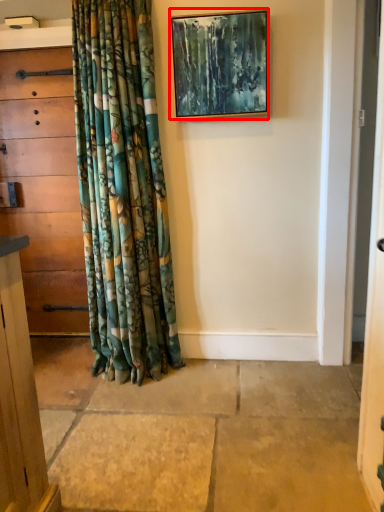
Question: In this image, where is picture frame (annotated by the red box) located relative to chest of drawers?

Choices:
 (A) right
 (B) left

Answer: (A)